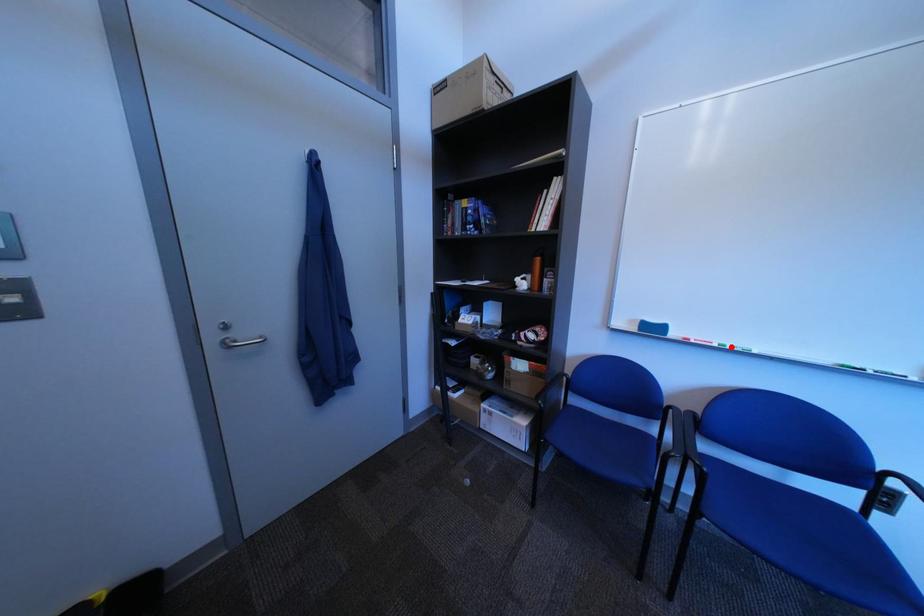
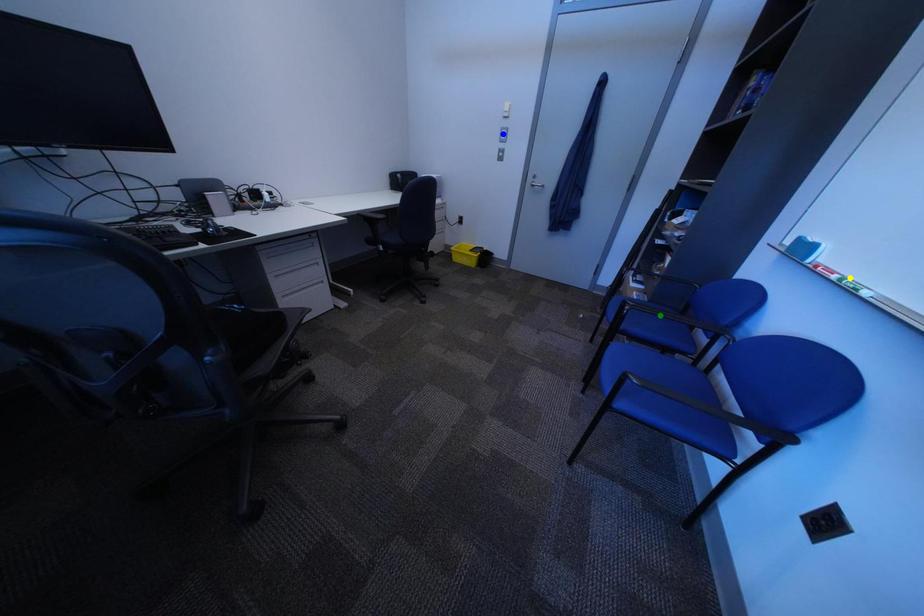
Question: I am providing you with two images of the same scene from different viewpoints. A red point is marked on the first image. You are given multiple points on the second image. Which mark in image 2 goes with the point in image 1?

Choices:
 (A) green point
 (B) yellow point
 (C) blue point

Answer: (B)